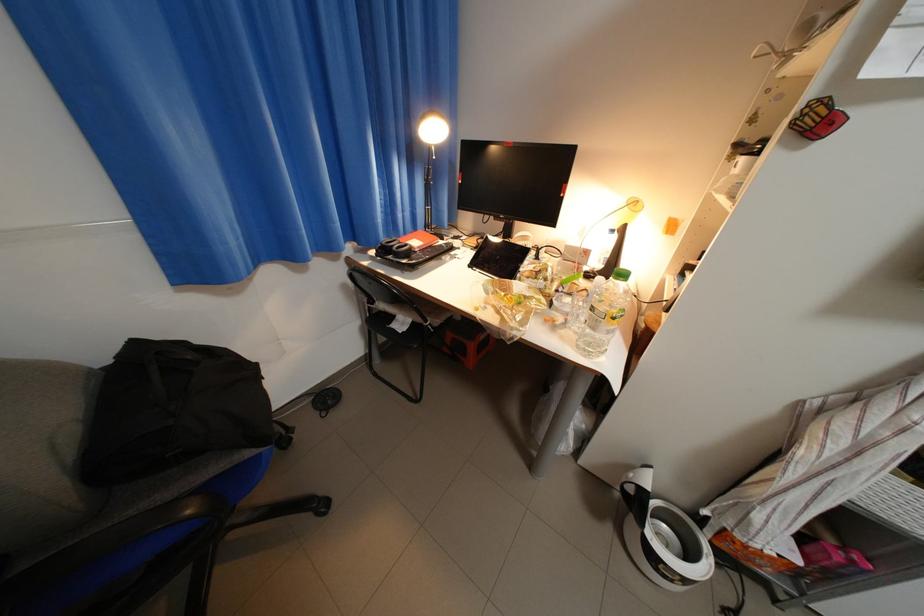
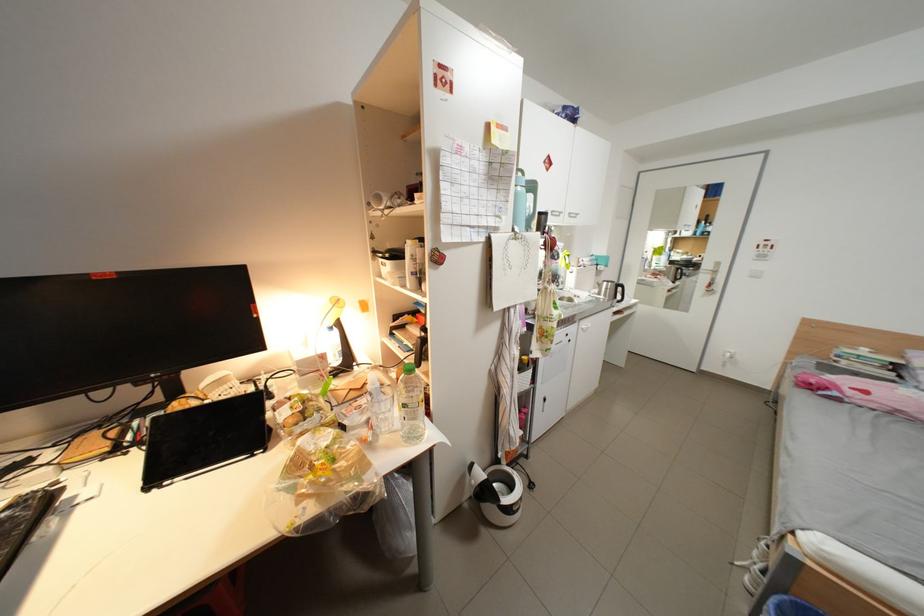
The point at [642,476] is marked in the first image. Where is the corresponding point in the second image?

(484, 483)